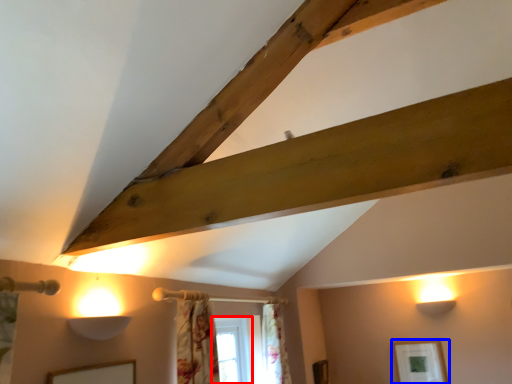
Question: Which of the following is the closest to the observer, window (highlighted by a red box) or picture frame (highlighted by a blue box)?

Choices:
 (A) window
 (B) picture frame

Answer: (A)